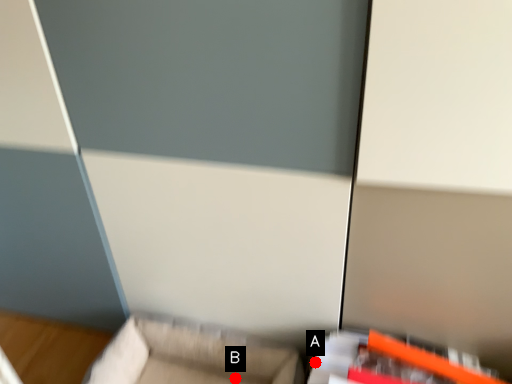
Question: Two points are circled on the image, labeled by A and B beside each circle. Which point is closer to the camera?

Choices:
 (A) A is closer
 (B) B is closer

Answer: (A)